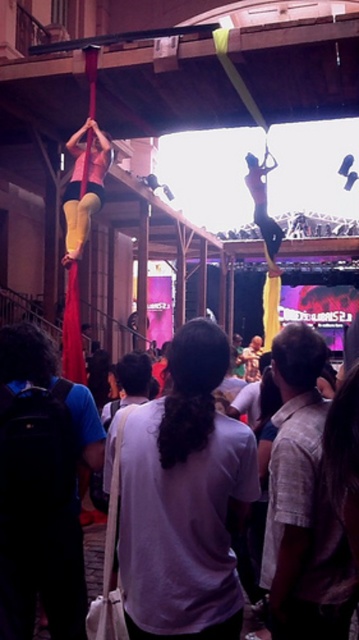
Question: Can you confirm if matte yellow leggings at left is smaller than skinny white pole at upper center?

Choices:
 (A) no
 (B) yes

Answer: (B)

Question: Which object is positioned closest to the skinny white pole at upper center?

Choices:
 (A) white cotton shirt at center
 (B) matte yellow leggings at left

Answer: (B)

Question: Among these points, which one is farthest from the camera?

Choices:
 (A) (147, 488)
 (B) (91, 192)

Answer: (B)

Question: Observing the image, what is the correct spatial positioning of white cotton shirt at center in reference to skinny white pole at upper center?

Choices:
 (A) left
 (B) right

Answer: (A)

Question: Can you confirm if matte yellow leggings at left is positioned to the left of skinny white pole at upper center?

Choices:
 (A) yes
 (B) no

Answer: (A)

Question: Considering the real-world distances, which object is closest to the matte yellow leggings at left?

Choices:
 (A) white cotton shirt at center
 (B) skinny white pole at upper center

Answer: (B)